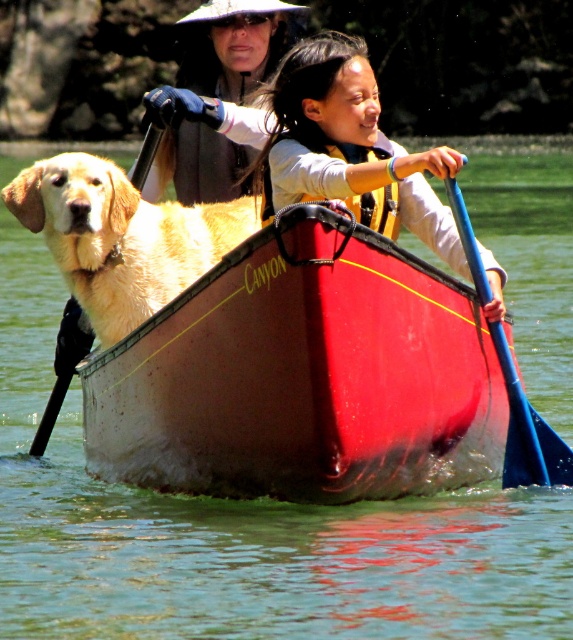
Question: Among these objects, which one is nearest to the camera?

Choices:
 (A) golden fur dog at left
 (B) shiny red canoe at center

Answer: (B)

Question: Which point is closer to the camera?

Choices:
 (A) (540, 474)
 (B) (85, 230)
 (C) (368, 196)

Answer: (A)

Question: Is shiny red canoe at center further to camera compared to blue plastic paddle at right?

Choices:
 (A) no
 (B) yes

Answer: (A)

Question: From the image, what is the correct spatial relationship of yellow golden retriever at center in relation to blue plastic paddle at right?

Choices:
 (A) left
 (B) right

Answer: (A)

Question: Which point is closer to the camera?

Choices:
 (A) shiny red canoe at center
 (B) golden fur dog at left

Answer: (A)

Question: Does matte black jacket at upper center appear under yellow/yellowish fabric life jacket at center?

Choices:
 (A) no
 (B) yes

Answer: (A)